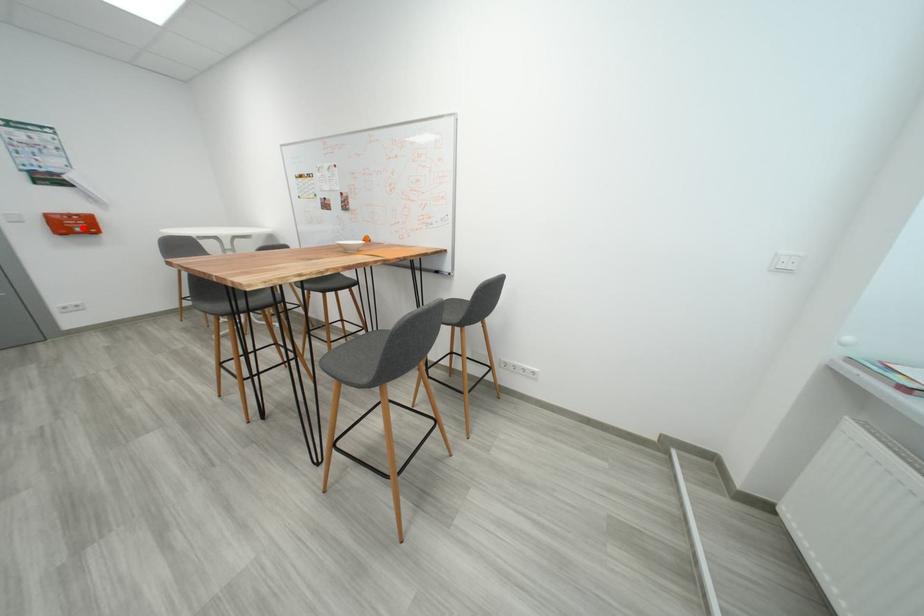
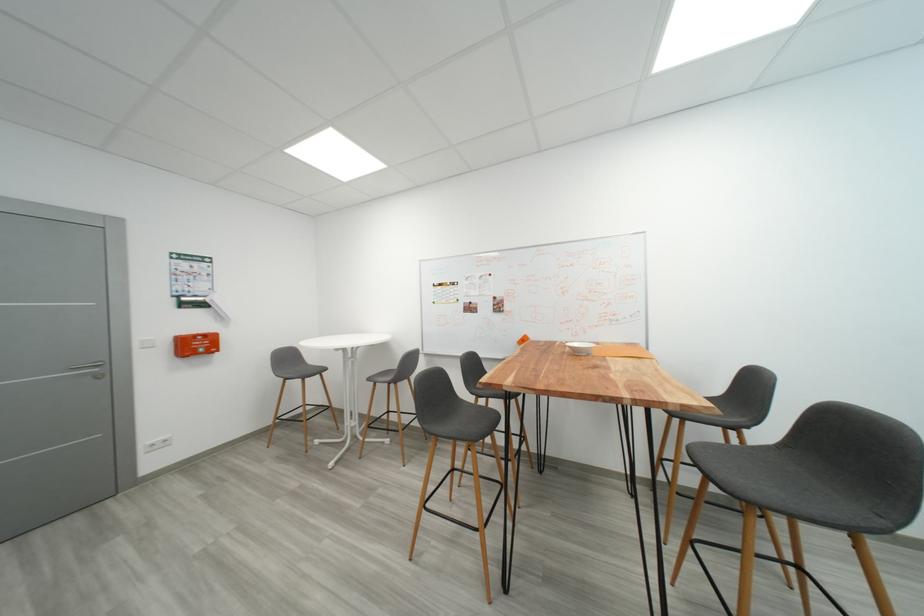
Where in the second image is the point corresponding to the highlighted location from the first image?

(203, 347)